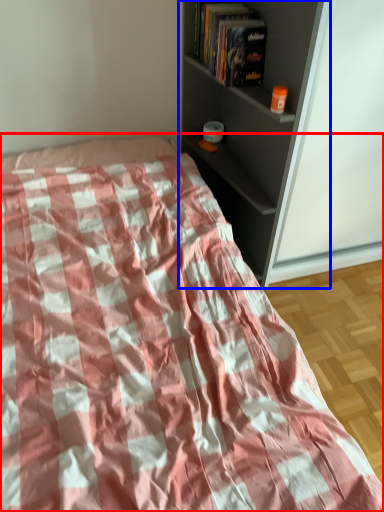
Question: Among these objects, which one is nearest to the camera, bed (highlighted by a red box) or shelf (highlighted by a blue box)?

Choices:
 (A) bed
 (B) shelf

Answer: (A)